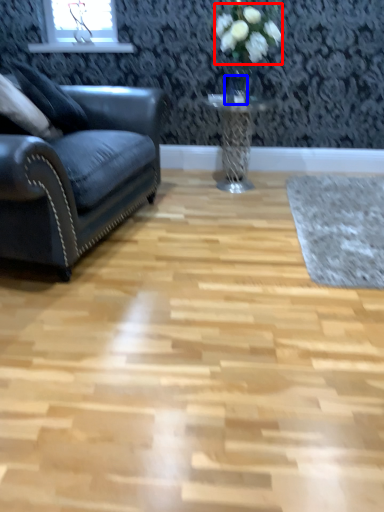
Question: Among these objects, which one is nearest to the camera, flower (highlighted by a red box) or glass vase (highlighted by a blue box)?

Choices:
 (A) flower
 (B) glass vase

Answer: (A)